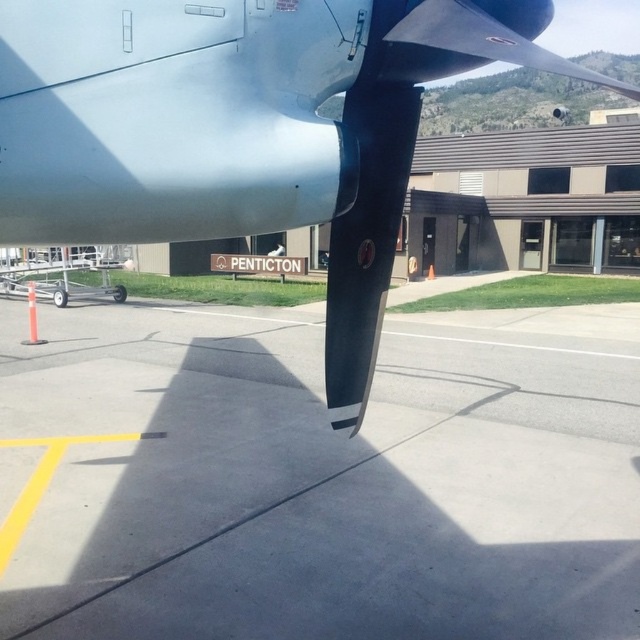
Question: Considering the relative positions of gray concrete tarmac at center and polished aluminum propeller at center in the image provided, where is gray concrete tarmac at center located with respect to polished aluminum propeller at center?

Choices:
 (A) right
 (B) left

Answer: (A)

Question: Which of the following is the farthest from the observer?

Choices:
 (A) polished aluminum propeller at center
 (B) gray concrete tarmac at center

Answer: (B)

Question: Which of the following is the closest to the observer?

Choices:
 (A) gray concrete tarmac at center
 (B) polished aluminum propeller at center

Answer: (B)

Question: Can you confirm if gray concrete tarmac at center is positioned below polished aluminum propeller at center?

Choices:
 (A) no
 (B) yes

Answer: (B)

Question: Which point appears farthest from the camera in this image?

Choices:
 (A) (296, 525)
 (B) (348, 428)

Answer: (A)

Question: In this image, where is gray concrete tarmac at center located relative to polished aluminum propeller at center?

Choices:
 (A) above
 (B) below

Answer: (B)